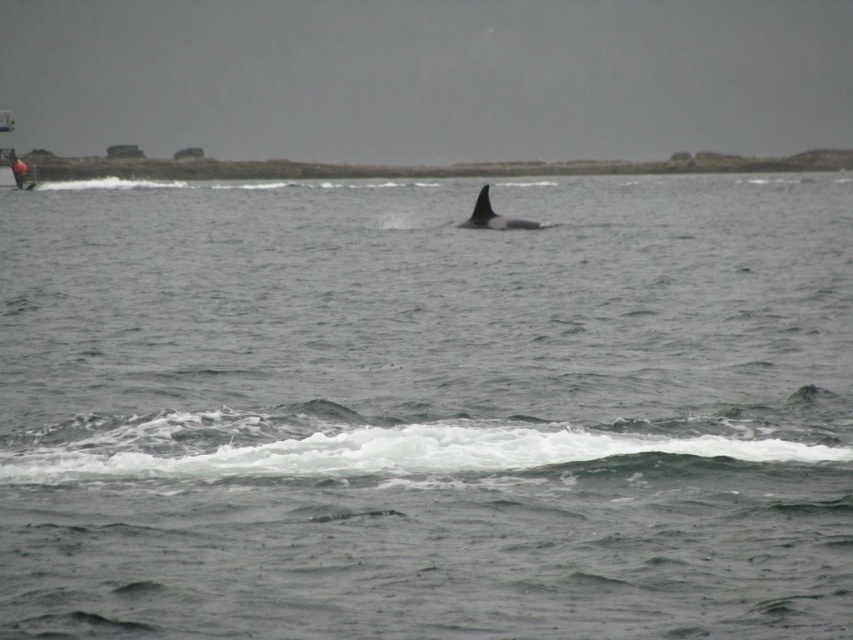
You are a marine biologist observing the sea scene. You notice the gray matte water at center and the black smooth whale at center. Which object appears taller in the image?

The gray matte water at center appears taller than the black smooth whale at center in the image.

You are a marine biologist observing the sea scene. You notice the gray matte water at center and the black smooth whale at center. Which object occupies a larger area in the image?

The gray matte water at center is bigger than the black smooth whale at center, so the gray matte water at center occupies a larger area in the image.